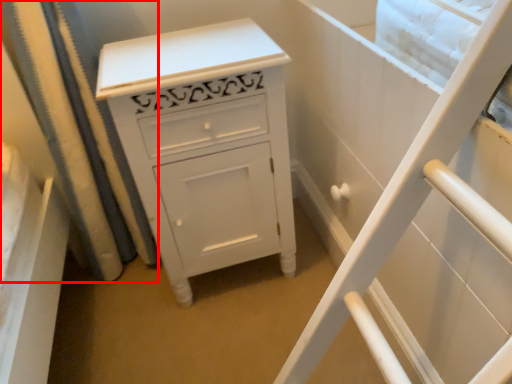
Question: From the image's perspective, where is shower curtain (annotated by the red box) located relative to chest of drawers?

Choices:
 (A) above
 (B) below

Answer: (A)